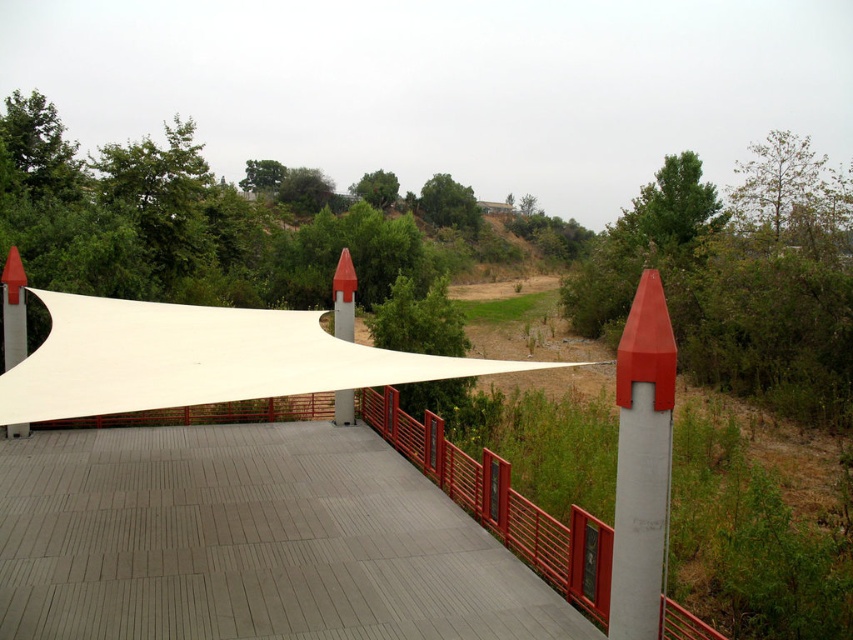
You are standing on the gray wood path at center and want to reach the white fabric canopy at center. Which direction should you move to get there?

You should move to the right to reach the white fabric canopy at center because the gray wood path at center is to the left of it.